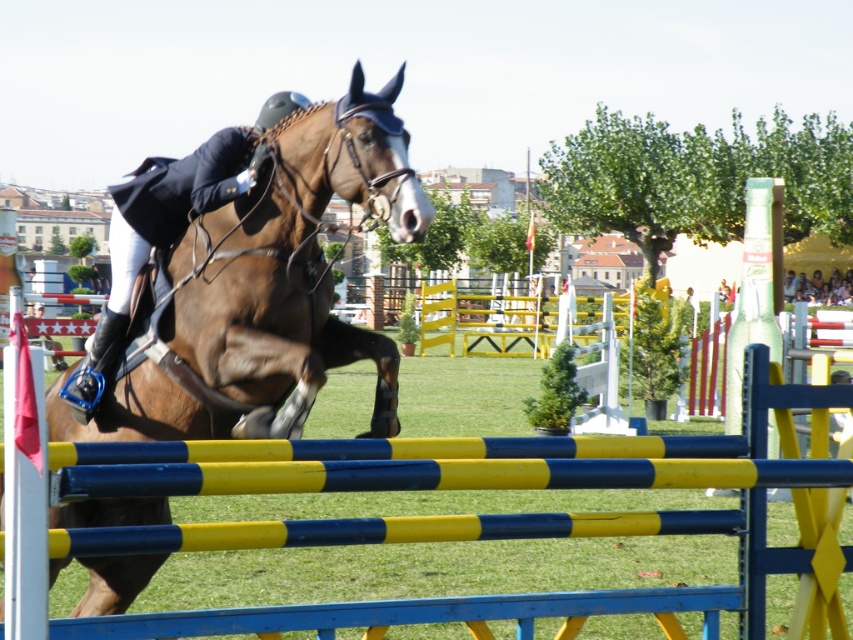
Which of these two, brown glossy horse at center or shiny black jacket at center, stands shorter?

With less height is brown glossy horse at center.

Image resolution: width=853 pixels, height=640 pixels. I want to click on brown glossy horse at center, so (x=265, y=291).

The image size is (853, 640). I want to click on brown glossy horse at center, so click(x=265, y=291).

Does shiny black jacket at center lie in front of light blue denim jacket at upper center?

That is True.

Which is more to the right, shiny black jacket at center or light blue denim jacket at upper center?

Positioned to the right is light blue denim jacket at upper center.

Image resolution: width=853 pixels, height=640 pixels. What do you see at coordinates (166, 227) in the screenshot? I see `shiny black jacket at center` at bounding box center [166, 227].

The height and width of the screenshot is (640, 853). I want to click on shiny black jacket at center, so click(166, 227).

Is blue/yellow striped hurdle at center below shiny black jacket at center?

Yes, blue/yellow striped hurdle at center is below shiny black jacket at center.

Between point (637, 609) and point (141, 259), which one is positioned behind?

Positioned behind is point (141, 259).

The height and width of the screenshot is (640, 853). I want to click on blue/yellow striped hurdle at center, so (389, 614).